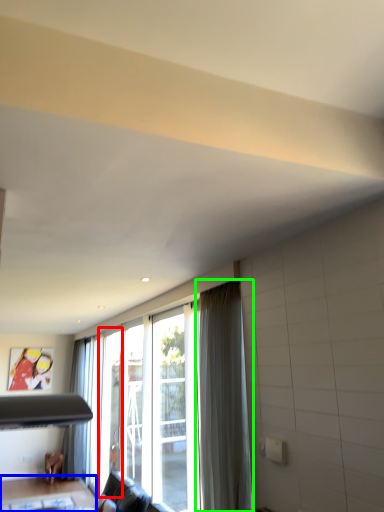
Question: Which object is the closest to the screen door (highlighted by a red box)? Choose among these: table (highlighted by a blue box) or curtain (highlighted by a green box).

Choices:
 (A) table
 (B) curtain

Answer: (A)